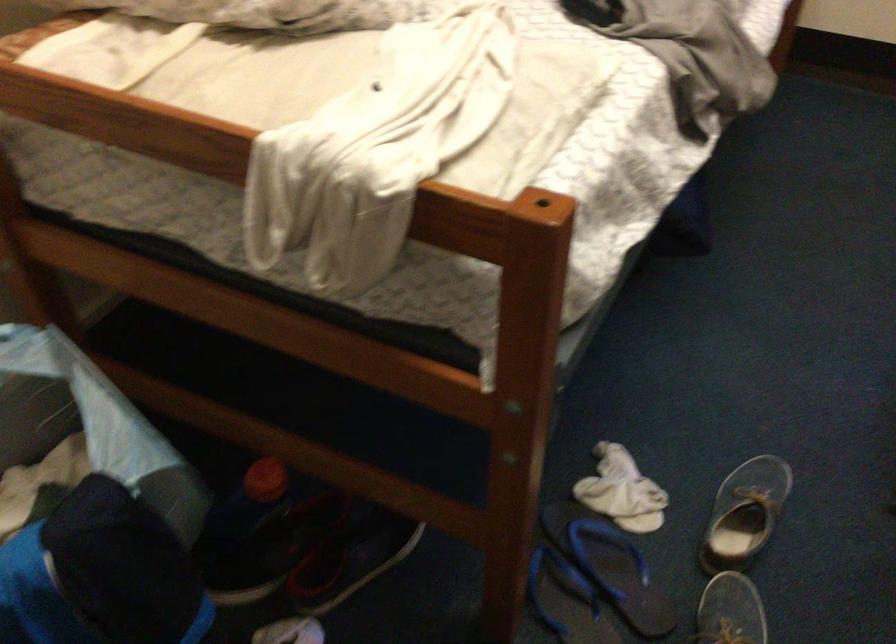
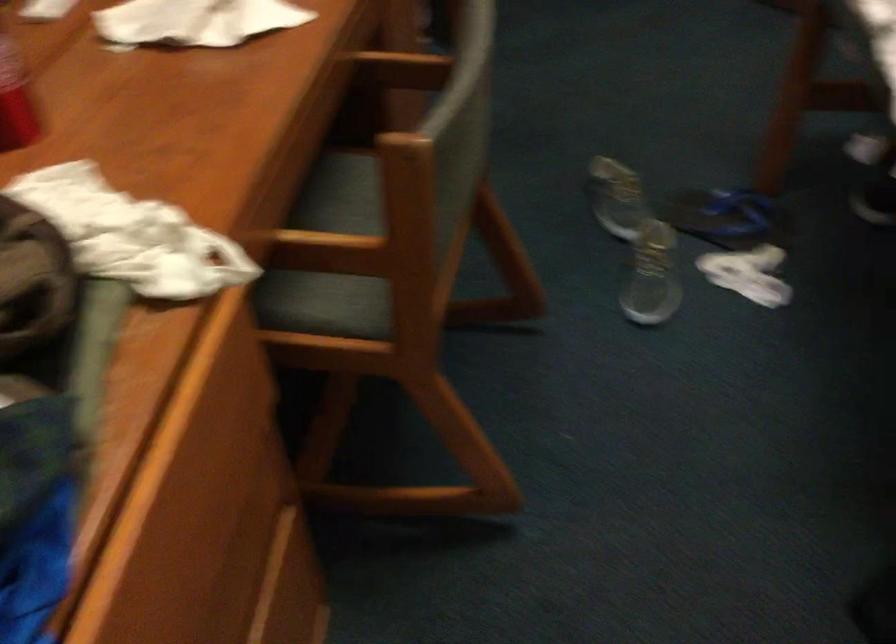
The point at (756, 482) is marked in the first image. Where is the corresponding point in the second image?

(650, 287)